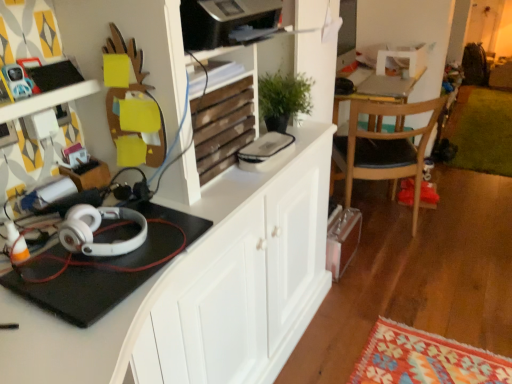
Question: From a real-world perspective, is wooden at upper center located beneath white matte headphones at left?

Choices:
 (A) no
 (B) yes

Answer: (A)

Question: Is wooden at upper center not inside white matte headphones at left?

Choices:
 (A) yes
 (B) no

Answer: (A)

Question: Is wooden at upper center positioned with its back to white matte headphones at left?

Choices:
 (A) no
 (B) yes

Answer: (A)

Question: From the image's perspective, is wooden at upper center above white matte headphones at left?

Choices:
 (A) yes
 (B) no

Answer: (A)

Question: Is white matte headphones at left a part of wooden at upper center?

Choices:
 (A) yes
 (B) no

Answer: (B)

Question: From the image's perspective, is wooden chair with black seat cushion at right located above or below white matte cabinet at center?

Choices:
 (A) above
 (B) below

Answer: (A)

Question: Looking at their shapes, would you say wooden chair with black seat cushion at right is wider or thinner than white matte cabinet at center?

Choices:
 (A) thin
 (B) wide

Answer: (A)

Question: In terms of size, does wooden chair with black seat cushion at right appear bigger or smaller than white matte cabinet at center?

Choices:
 (A) big
 (B) small

Answer: (B)

Question: From a real-world perspective, is wooden chair with black seat cushion at right positioned above or below white matte cabinet at center?

Choices:
 (A) above
 (B) below

Answer: (B)

Question: From the image's perspective, is matte black phone at upper left positioned above or below wooden chair with black seat cushion at right?

Choices:
 (A) above
 (B) below

Answer: (A)

Question: Looking at their shapes, would you say matte black phone at upper left is wider or thinner than wooden chair with black seat cushion at right?

Choices:
 (A) thin
 (B) wide

Answer: (A)

Question: Looking at the image, does matte black phone at upper left seem bigger or smaller compared to wooden chair with black seat cushion at right?

Choices:
 (A) small
 (B) big

Answer: (A)

Question: From a real-world perspective, is matte black phone at upper left positioned above or below wooden chair with black seat cushion at right?

Choices:
 (A) above
 (B) below

Answer: (A)

Question: Based on their sizes in the image, would you say green plush rug at lower right is bigger or smaller than wooden at upper center?

Choices:
 (A) big
 (B) small

Answer: (A)

Question: Relative to wooden at upper center, is green plush rug at lower right in front or behind?

Choices:
 (A) front
 (B) behind

Answer: (B)